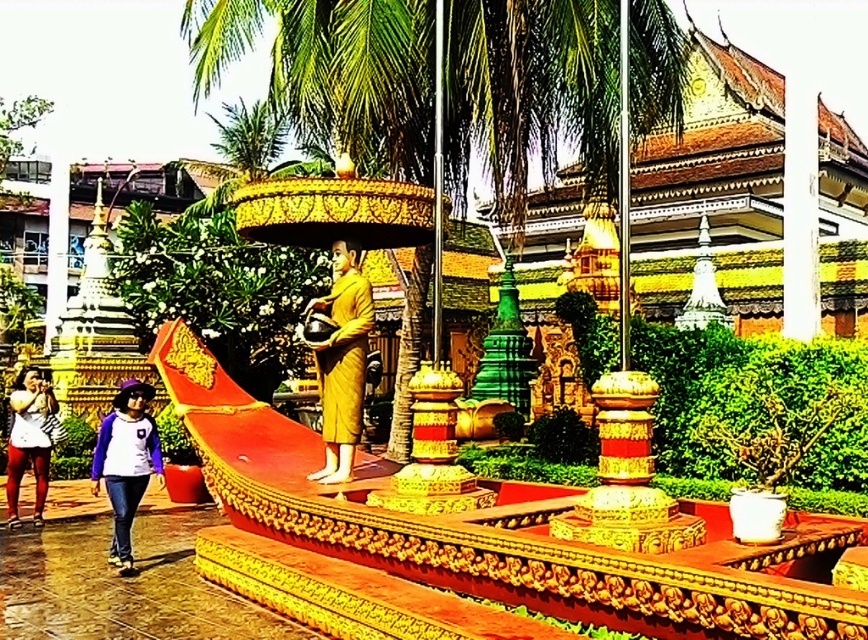
Question: Which object appears closest to the camera in this image?

Choices:
 (A) matte white shirt at lower left
 (B) yellow matte statue at center
 (C) white cotton shirt at lower left

Answer: (B)

Question: Can you confirm if white cotton shirt at lower left is smaller than matte white shirt at lower left?

Choices:
 (A) yes
 (B) no

Answer: (A)

Question: Observing the image, what is the correct spatial positioning of yellow matte statue at center in reference to white cotton shirt at lower left?

Choices:
 (A) below
 (B) above

Answer: (B)

Question: Which object is positioned closest to the matte white shirt at lower left?

Choices:
 (A) white cotton shirt at lower left
 (B) golden polished boat at center

Answer: (A)

Question: Which point appears closest to the camera in this image?

Choices:
 (A) (47, 396)
 (B) (132, 460)

Answer: (B)

Question: In this image, where is golden polished boat at center located relative to white cotton shirt at lower left?

Choices:
 (A) right
 (B) left

Answer: (A)